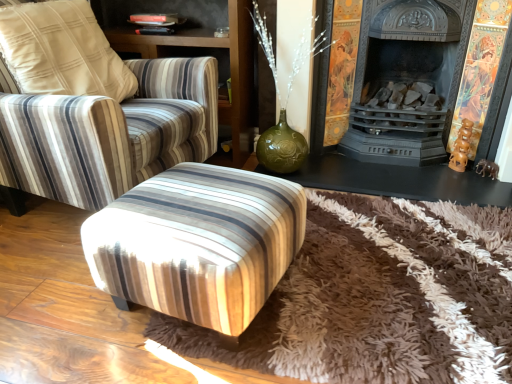
Question: Is brown shaggy rug at center not inside striped fabric armchair at upper left?

Choices:
 (A) yes
 (B) no

Answer: (A)

Question: Is brown shaggy rug at center to the left of striped fabric armchair at upper left from the viewer's perspective?

Choices:
 (A) no
 (B) yes

Answer: (A)

Question: Is striped fabric armchair at upper left completely or partially inside brown shaggy rug at center?

Choices:
 (A) no
 (B) yes

Answer: (A)

Question: Is brown shaggy rug at center to the right of striped fabric armchair at upper left from the viewer's perspective?

Choices:
 (A) yes
 (B) no

Answer: (A)

Question: Does brown shaggy rug at center have a larger size compared to striped fabric armchair at upper left?

Choices:
 (A) yes
 (B) no

Answer: (A)

Question: Choose the correct answer: Is matte black fireplace at center inside brown shaggy rug at center or outside it?

Choices:
 (A) inside
 (B) outside

Answer: (A)

Question: Is point (464, 193) positioned closer to the camera than point (361, 289)?

Choices:
 (A) closer
 (B) farther

Answer: (B)

Question: From the image's perspective, is matte black fireplace at center above or below brown shaggy rug at center?

Choices:
 (A) below
 (B) above

Answer: (B)

Question: Considering the relative positions of matte black fireplace at center and brown shaggy rug at center in the image provided, is matte black fireplace at center to the left or to the right of brown shaggy rug at center?

Choices:
 (A) right
 (B) left

Answer: (A)

Question: Considering the positions of striped fabric armchair at upper left and black cast iron fireplace at center in the image, is striped fabric armchair at upper left taller or shorter than black cast iron fireplace at center?

Choices:
 (A) short
 (B) tall

Answer: (B)

Question: Is striped fabric armchair at upper left wider or thinner than black cast iron fireplace at center?

Choices:
 (A) thin
 (B) wide

Answer: (B)

Question: Looking at the image, does striped fabric armchair at upper left seem bigger or smaller compared to black cast iron fireplace at center?

Choices:
 (A) small
 (B) big

Answer: (B)

Question: Considering the positions of point pos(181,44) and point pos(486,188), is point pos(181,44) closer or farther from the camera than point pos(486,188)?

Choices:
 (A) farther
 (B) closer

Answer: (A)

Question: From a real-world perspective, relative to black cast iron fireplace at center, is striped fabric chair at center vertically above or below?

Choices:
 (A) above
 (B) below

Answer: (A)

Question: Considering the positions of point (118, 99) and point (293, 173), is point (118, 99) closer or farther from the camera than point (293, 173)?

Choices:
 (A) farther
 (B) closer

Answer: (B)